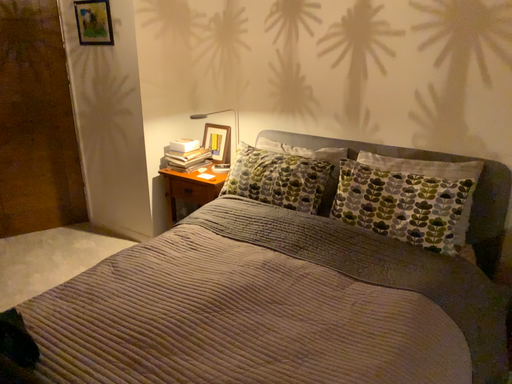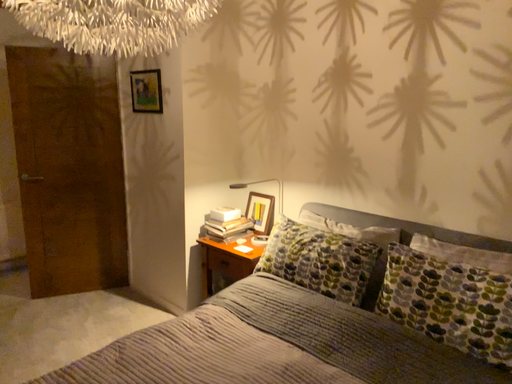
Question: Which way did the camera rotate in the video?

Choices:
 (A) rotated downward
 (B) rotated upward

Answer: (B)